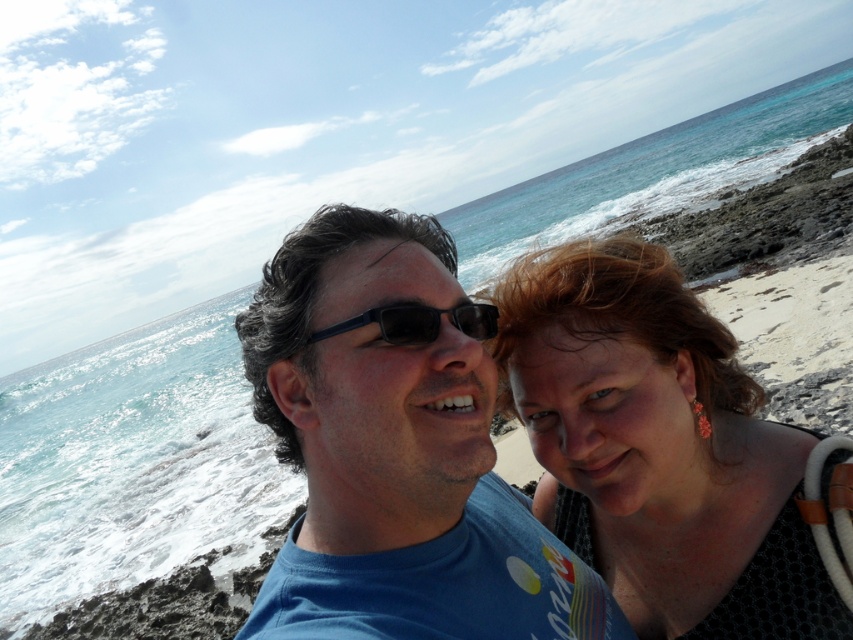
Looking at this image, does matte black hair at center appear under black plastic sunglasses at center?

Yes.

Who is more distant from viewer, (608, 540) or (379, 330)?

The point (608, 540) is more distant.

Describe the element at coordinates (669, 451) in the screenshot. I see `matte black hair at center` at that location.

Find the location of `matte black hair at center`. matte black hair at center is located at coordinates (669, 451).

Which is behind, point (380, 620) or point (495, 310)?

The point (495, 310) is more distant.

Is blue matte shirt at center above black plastic sunglasses at center?

No.

Is point (433, 593) more distant than point (434, 314)?

No, it is not.

The image size is (853, 640). I want to click on blue matte shirt at center, so click(396, 449).

Which is above, blue matte shirt at center or matte black hair at center?

blue matte shirt at center is above.

Where is `blue matte shirt at center`? blue matte shirt at center is located at coordinates (396, 449).

The height and width of the screenshot is (640, 853). What are the coordinates of `blue matte shirt at center` in the screenshot? It's located at (396, 449).